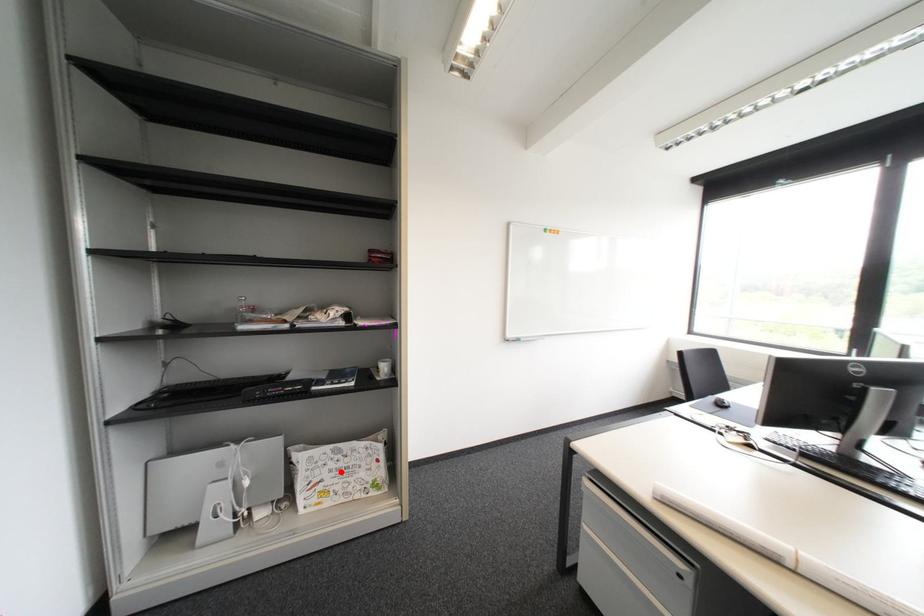
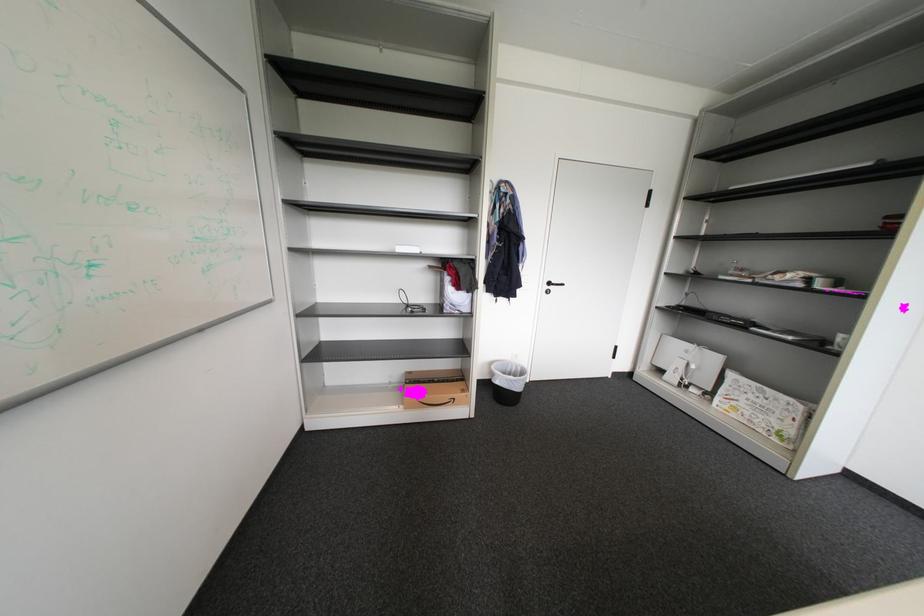
Question: I am providing you with two images of the same scene from different viewpoints. In image1, a red point is highlighted. Considering the same 3D point in image2, which of the following is correct?

Choices:
 (A) It is closer
 (B) It is farther

Answer: (A)